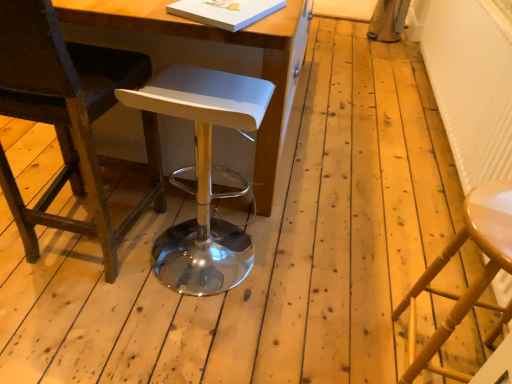
This screenshot has width=512, height=384. Identify the location of vacant region to the left of wooden chair at right, the first stool when ordered from right to left. (332, 336).